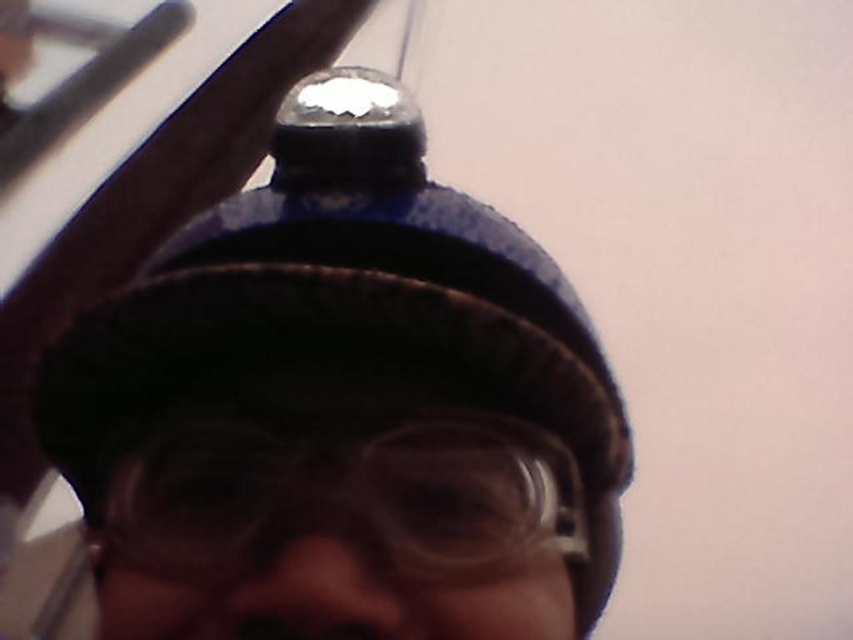
You are a safety inspector checking the equipment of a worker. You notice the blue fabric cap at center and the transparent plastic goggles at center. Which piece of equipment is taller?

The blue fabric cap at center is taller than the transparent plastic goggles at center.

You are a safety inspector checking the equipment of a worker. The worker is wearing a dark hard hat with a metallic screw at the top and clear safety goggles with a black frame. You notice a point at coordinates (347, 330) on the image. According to the scene description, what object is located at that point?

The point at coordinates (347, 330) corresponds to the blue fabric cap at center.

You are a safety inspector checking the equipment of a worker. You notice the blue fabric cap at center and the transparent plastic goggles at center. According to safety protocols, which item should be positioned in front to ensure proper visibility?

The transparent plastic goggles at center are positioned behind the blue fabric cap at center, which violates safety protocols. The goggles should be in front to ensure unobstructed visibility.